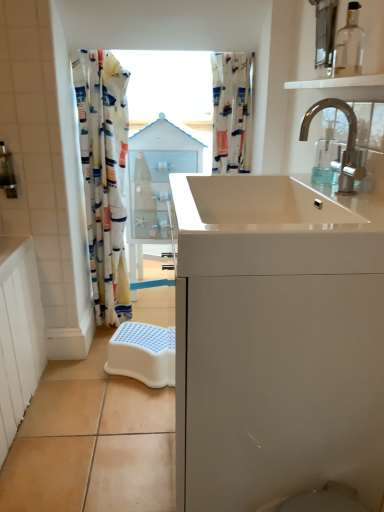
Question: Can you confirm if white fabric shower curtain at upper center is positioned to the left of transparent glass bottle at upper right?

Choices:
 (A) yes
 (B) no

Answer: (A)

Question: Does white fabric shower curtain at upper center have a smaller size compared to transparent glass bottle at upper right?

Choices:
 (A) no
 (B) yes

Answer: (A)

Question: Does white fabric shower curtain at upper center have a lesser width compared to transparent glass bottle at upper right?

Choices:
 (A) no
 (B) yes

Answer: (A)

Question: Considering the relative positions of white fabric shower curtain at upper center and transparent glass bottle at upper right in the image provided, is white fabric shower curtain at upper center to the right of transparent glass bottle at upper right from the viewer's perspective?

Choices:
 (A) yes
 (B) no

Answer: (B)

Question: Considering the relative sizes of white fabric shower curtain at upper center and transparent glass bottle at upper right in the image provided, is white fabric shower curtain at upper center taller than transparent glass bottle at upper right?

Choices:
 (A) no
 (B) yes

Answer: (B)

Question: Is white fabric shower curtain at upper center to the left or to the right of transparent glass shelf at upper right in the image?

Choices:
 (A) left
 (B) right

Answer: (A)

Question: Looking at their shapes, would you say white fabric shower curtain at upper center is wider or thinner than transparent glass shelf at upper right?

Choices:
 (A) thin
 (B) wide

Answer: (B)

Question: Is white fabric shower curtain at upper center in front of or behind transparent glass shelf at upper right in the image?

Choices:
 (A) front
 (B) behind

Answer: (B)

Question: Considering the positions of point (218, 73) and point (289, 83), is point (218, 73) closer or farther from the camera than point (289, 83)?

Choices:
 (A) farther
 (B) closer

Answer: (A)

Question: Is chrome metallic faucet at upper right wider or thinner than white glossy medicine cabinet at center?

Choices:
 (A) thin
 (B) wide

Answer: (A)

Question: Is point (317, 101) closer or farther from the camera than point (134, 153)?

Choices:
 (A) farther
 (B) closer

Answer: (B)

Question: Based on their sizes in the image, would you say chrome metallic faucet at upper right is bigger or smaller than white glossy medicine cabinet at center?

Choices:
 (A) small
 (B) big

Answer: (A)

Question: From their relative heights in the image, would you say chrome metallic faucet at upper right is taller or shorter than white glossy medicine cabinet at center?

Choices:
 (A) short
 (B) tall

Answer: (A)

Question: Based on their positions, is white glossy medicine cabinet at center located to the left or right of white fabric shower curtain at upper center?

Choices:
 (A) left
 (B) right

Answer: (A)

Question: Considering the positions of white glossy medicine cabinet at center and white fabric shower curtain at upper center in the image, is white glossy medicine cabinet at center wider or thinner than white fabric shower curtain at upper center?

Choices:
 (A) wide
 (B) thin

Answer: (A)